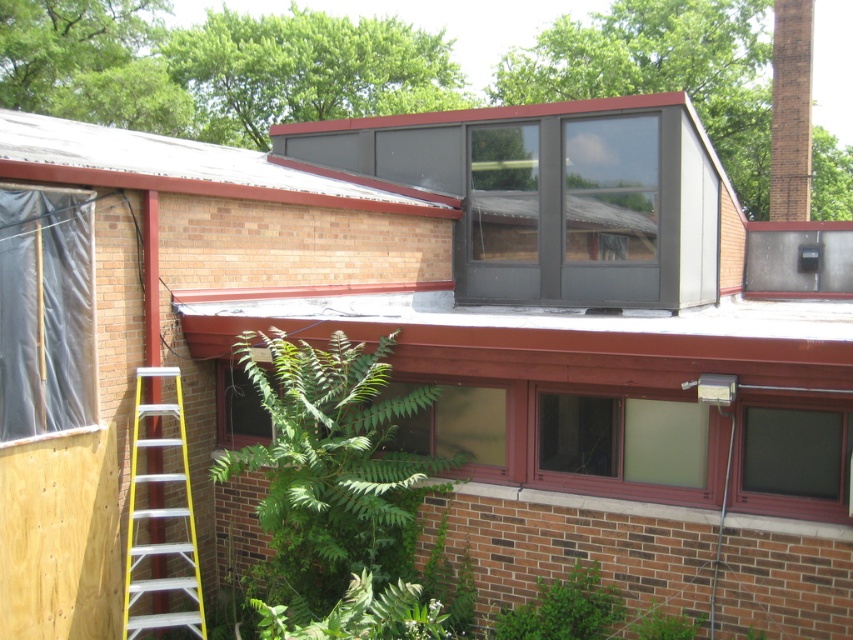
You are a construction worker needing to cover a damaged section of the roof. You have the black plastic tarp at left and the brown brick chimney at upper right in your view. Which object is wider so you can decide which area to prioritize covering?

The black plastic tarp at left is wider than the brown brick chimney at upper right, so you should prioritize covering the area where the black plastic tarp at left is located.

You are standing in front of the brick building and want to know which of the two points, point (456, 216) or point (772, 195), is closer to you. Can you determine this based on the image?

Point (456, 216) is closer to the camera than point (772, 195), so it is closer to you.

You are standing 20 feet away from a brick building with a sloped roof. You see a point marked at coordinate (59,372). Can you reach this point with a 25 foot ladder?

The distance of point (59,372) from viewer is 20.59 feet, so yes, a 25 foot ladder can reach it since it is longer than the distance.